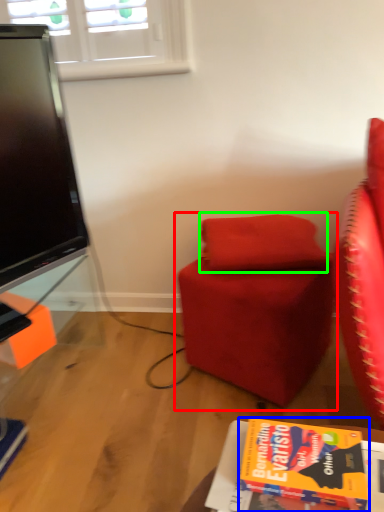
Question: Which object is positioned farthest from chair (highlighted by a red box)? Select from book (highlighted by a blue box) and pillow (highlighted by a green box).

Choices:
 (A) book
 (B) pillow

Answer: (A)